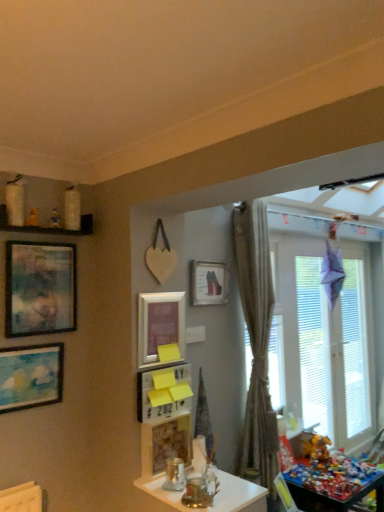
The width and height of the screenshot is (384, 512). What are the coordinates of `matte white picture frame at center, which is counted as the 5th picture frame, starting from the left` in the screenshot? It's located at (208, 283).

What do you see at coordinates (208, 283) in the screenshot?
I see `matte white picture frame at center, positioned as the first picture frame in right-to-left order` at bounding box center [208, 283].

In order to click on silky beige curtain at center in this screenshot , I will do `click(256, 340)`.

Where is `matte pink picture frame at center, positioned as the third picture frame in right-to-left order`? This screenshot has width=384, height=512. matte pink picture frame at center, positioned as the third picture frame in right-to-left order is located at coordinates (160, 324).

Image resolution: width=384 pixels, height=512 pixels. Describe the element at coordinates (30, 376) in the screenshot. I see `matte blue painting at left, which is the 5th picture frame from right to left` at that location.

Find the location of a particular element. white glossy jars at upper left is located at coordinates (47, 227).

This screenshot has height=512, width=384. What are the coordinates of `multicolored plastic toys at lower right, positioned as the 1th table in back-to-front order` in the screenshot? It's located at (334, 484).

Is matte wooden picture frame at upper left, the 4th picture frame when ordered from right to left, at the back of matte blue painting at left, the 1th picture frame positioned from the left?

No, matte blue painting at left, the 1th picture frame positioned from the left, is not facing away from matte wooden picture frame at upper left, the 4th picture frame when ordered from right to left.

At what (x,y) coordinates should I click in order to perform the action: click on the 3rd picture frame above when counting from the matte blue painting at left, which is the 5th picture frame from right to left (from the image's perspective). Please return your answer as a coordinate pair (x, y). This screenshot has width=384, height=512. Looking at the image, I should click on (40, 288).

Which object is wider, matte blue painting at left, the 1th picture frame positioned from the left, or matte wooden picture frame at upper left, the 4th picture frame when ordered from right to left?

Wider between the two is matte wooden picture frame at upper left, the 4th picture frame when ordered from right to left.

In the scene shown: Is white frosted glass window at right not near matte white picture frame at center, positioned as the first picture frame in right-to-left order?

Yes.

Does white frosted glass window at right appear on the left side of matte white picture frame at center, which is counted as the 5th picture frame, starting from the left?

Incorrect, white frosted glass window at right is not on the left side of matte white picture frame at center, which is counted as the 5th picture frame, starting from the left.

Could matte white picture frame at center, which is counted as the 5th picture frame, starting from the left, be considered to be inside white frosted glass window at right?

No.

Does white frosted glass window at right lie behind matte white picture frame at center, which is counted as the 5th picture frame, starting from the left?

Yes, the depth of white frosted glass window at right is greater than that of matte white picture frame at center, which is counted as the 5th picture frame, starting from the left.

Which object is closer to the camera, translucent glass table at center, marked as the first table in a top-to-bottom arrangement, or white glossy jars at upper left?

translucent glass table at center, marked as the first table in a top-to-bottom arrangement.

Is there a large distance between translucent glass table at center, which is the 2th table in bottom-to-top order, and white glossy jars at upper left?

Indeed, translucent glass table at center, which is the 2th table in bottom-to-top order, is not near white glossy jars at upper left.

From a real-world perspective, who is located lower, translucent glass table at center, marked as the first table in a top-to-bottom arrangement, or white glossy jars at upper left?

translucent glass table at center, marked as the first table in a top-to-bottom arrangement.

Considering the relative sizes of matte wooden picture frame at upper left, the 4th picture frame when ordered from right to left, and multicolored plastic toys at lower right, placed as the second table when sorted from left to right, in the image provided, is matte wooden picture frame at upper left, the 4th picture frame when ordered from right to left, bigger than multicolored plastic toys at lower right, placed as the second table when sorted from left to right,?

No, matte wooden picture frame at upper left, the 4th picture frame when ordered from right to left, is not bigger than multicolored plastic toys at lower right, placed as the second table when sorted from left to right.

Is point (33, 294) more distant than point (306, 508)?

No, it is not.

Between matte wooden picture frame at upper left, the 4th picture frame when ordered from right to left, and multicolored plastic toys at lower right, placed as the second table when sorted from left to right, which one appears on the right side from the viewer's perspective?

multicolored plastic toys at lower right, placed as the second table when sorted from left to right.

From the image's perspective, is matte wooden picture frame at upper left, the second picture frame when ordered from left to right, over multicolored plastic toys at lower right, the first table ordered from the bottom?

Yes.

Is wooden picture frame at center, which ranks as the fourth picture frame in left-to-right order, in front of or behind white frosted glass window at right in the image?

Visually, wooden picture frame at center, which ranks as the fourth picture frame in left-to-right order, is located in front of white frosted glass window at right.

Looking at this image, considering the relative sizes of wooden picture frame at center, which ranks as the fourth picture frame in left-to-right order, and white frosted glass window at right in the image provided, is wooden picture frame at center, which ranks as the fourth picture frame in left-to-right order, taller than white frosted glass window at right?

No, wooden picture frame at center, which ranks as the fourth picture frame in left-to-right order, is not taller than white frosted glass window at right.

How many degrees apart are the facing directions of wooden picture frame at center, which is counted as the second picture frame, starting from the right, and white frosted glass window at right?

0.862 degrees.

Considering the points (174, 441) and (353, 249), which point is behind, point (174, 441) or point (353, 249)?

The point (353, 249) is more distant.

Could you measure the distance between matte pink picture frame at center, positioned as the third picture frame in right-to-left order, and wooden picture frame at center, which ranks as the fourth picture frame in left-to-right order?

matte pink picture frame at center, positioned as the third picture frame in right-to-left order, is 16.37 inches from wooden picture frame at center, which ranks as the fourth picture frame in left-to-right order.

Considering the relative positions of matte pink picture frame at center, which is the third picture frame from left to right, and wooden picture frame at center, which ranks as the fourth picture frame in left-to-right order, in the image provided, is matte pink picture frame at center, which is the third picture frame from left to right, to the left of wooden picture frame at center, which ranks as the fourth picture frame in left-to-right order, from the viewer's perspective?

Indeed, matte pink picture frame at center, which is the third picture frame from left to right, is positioned on the left side of wooden picture frame at center, which ranks as the fourth picture frame in left-to-right order.

Considering the sizes of objects matte pink picture frame at center, which is the third picture frame from left to right, and wooden picture frame at center, which ranks as the fourth picture frame in left-to-right order, in the image provided, who is smaller, matte pink picture frame at center, which is the third picture frame from left to right, or wooden picture frame at center, which ranks as the fourth picture frame in left-to-right order,?

Smaller between the two is matte pink picture frame at center, which is the third picture frame from left to right.

From a real-world perspective, which object rests below the other?

In real-world perspective, matte blue painting at left, which is the 5th picture frame from right to left, is lower.

Visually, is matte wooden picture frame at upper left, the 4th picture frame when ordered from right to left, positioned to the left or to the right of matte blue painting at left, which is the 5th picture frame from right to left?

Clearly, matte wooden picture frame at upper left, the 4th picture frame when ordered from right to left, is on the right of matte blue painting at left, which is the 5th picture frame from right to left, in the image.

From the image's perspective, which is above, matte wooden picture frame at upper left, the second picture frame when ordered from left to right, or matte blue painting at left, which is the 5th picture frame from right to left?

matte wooden picture frame at upper left, the second picture frame when ordered from left to right, appears higher in the image.

Measure the distance from matte wooden picture frame at upper left, the 4th picture frame when ordered from right to left, to matte blue painting at left, which is the 5th picture frame from right to left.

The distance of matte wooden picture frame at upper left, the 4th picture frame when ordered from right to left, from matte blue painting at left, which is the 5th picture frame from right to left, is 23.66 centimeters.

From a real-world perspective, which picture frame is the 2nd one underneath the matte wooden picture frame at upper left, the second picture frame when ordered from left to right? Please provide its 2D coordinates.

[(30, 376)]

I want to click on window that is behind the matte white picture frame at center, positioned as the first picture frame in right-to-left order, so [323, 341].

Which object lies nearer to the anchor point translucent glass table at center, the 2th table positioned from the back, white glossy jars at upper left or matte pink picture frame at center, positioned as the third picture frame in right-to-left order?

matte pink picture frame at center, positioned as the third picture frame in right-to-left order, is positioned closer to the anchor translucent glass table at center, the 2th table positioned from the back.

Based on their spatial positions, is matte wooden picture frame at upper left, the second picture frame when ordered from left to right, or wooden picture frame at center, which is counted as the second picture frame, starting from the right, further from white glossy jars at upper left?

wooden picture frame at center, which is counted as the second picture frame, starting from the right, is positioned further to the anchor white glossy jars at upper left.

When comparing their distances from white glossy jars at upper left, does wooden picture frame at center, which is counted as the second picture frame, starting from the right, or matte blue painting at left, the 1th picture frame positioned from the left, seem further?

wooden picture frame at center, which is counted as the second picture frame, starting from the right, lies further to white glossy jars at upper left than the other object.

From the image, which object appears to be nearer to matte white picture frame at center, which is counted as the 5th picture frame, starting from the left, multicolored plastic toys at lower right, the second table in the front-to-back sequence, or white frosted glass window at right?

multicolored plastic toys at lower right, the second table in the front-to-back sequence, lies closer to matte white picture frame at center, which is counted as the 5th picture frame, starting from the left, than the other object.

Based on their spatial positions, is matte wooden picture frame at upper left, the second picture frame when ordered from left to right, or matte white picture frame at center, which is counted as the 5th picture frame, starting from the left, further from translucent glass table at center, placed as the 1th table when sorted from front to back?

matte white picture frame at center, which is counted as the 5th picture frame, starting from the left, is further to translucent glass table at center, placed as the 1th table when sorted from front to back.

Which object lies nearer to the anchor point multicolored plastic toys at lower right, placed as the second table when sorted from left to right, silky beige curtain at center or white frosted glass window at right?

Based on the image, silky beige curtain at center appears to be nearer to multicolored plastic toys at lower right, placed as the second table when sorted from left to right.

Estimate the real-world distances between objects in this image. Which object is further from multicolored plastic toys at lower right, which is counted as the 1th table, starting from the right, white frosted glass window at right or matte pink picture frame at center, which is the third picture frame from left to right?

matte pink picture frame at center, which is the third picture frame from left to right, is positioned further to the anchor multicolored plastic toys at lower right, which is counted as the 1th table, starting from the right.

Which object lies nearer to the anchor point matte white picture frame at center, which is counted as the 5th picture frame, starting from the left, white glossy jars at upper left or white frosted glass window at right?

Among the two, white glossy jars at upper left is located nearer to matte white picture frame at center, which is counted as the 5th picture frame, starting from the left.

At what (x,y) coordinates should I click in order to perform the action: click on window between matte white picture frame at center, which is counted as the 5th picture frame, starting from the left, and multicolored plastic toys at lower right, which is counted as the 1th table, starting from the right, vertically. Please return your answer as a coordinate pair (x, y). This screenshot has height=512, width=384. Looking at the image, I should click on (323, 341).

You are a GUI agent. You are given a task and a screenshot of the screen. Output one action in this format:
    pyautogui.click(x=<x>, y=<y>)
    Task: Click on the shelf between matte blue painting at left, which is the 5th picture frame from right to left, and white frosted glass window at right, in the horizontal direction
    
    Given the screenshot: What is the action you would take?
    pyautogui.click(x=47, y=227)

Locate an element on the screen. The width and height of the screenshot is (384, 512). picture frame between matte blue painting at left, the 1th picture frame positioned from the left, and matte pink picture frame at center, which is the third picture frame from left to right is located at coordinates (40, 288).

This screenshot has width=384, height=512. In order to click on curtain located between multicolored plastic toys at lower right, which is counted as the 1th table, starting from the right, and white frosted glass window at right in the depth direction in this screenshot , I will do `click(256, 340)`.